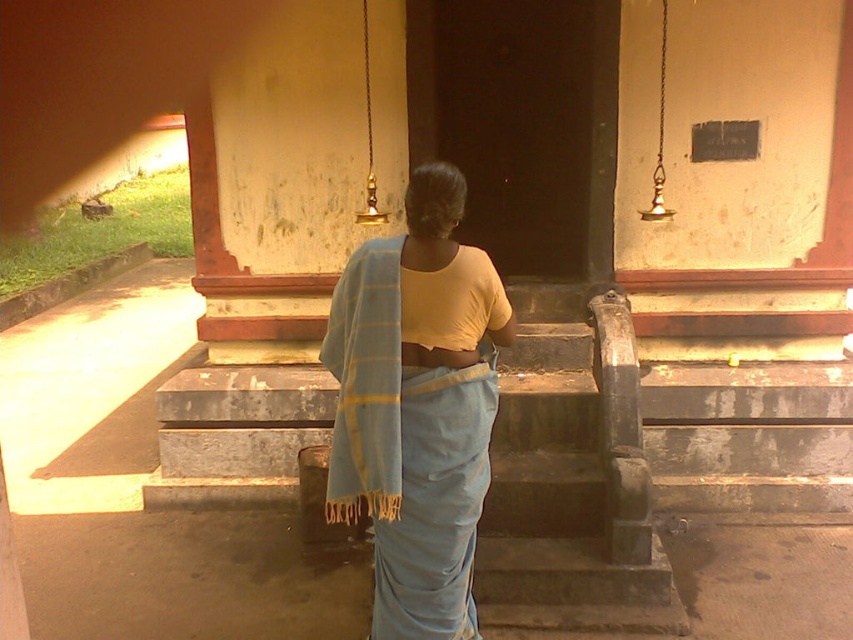
Question: Which of the following is the closest to the observer?

Choices:
 (A) light blue woven shawl at center
 (B) light blue fabric at center

Answer: (B)

Question: Is light blue fabric at center above light blue woven shawl at center?

Choices:
 (A) yes
 (B) no

Answer: (B)

Question: Can you confirm if light blue fabric at center is positioned to the left of light blue woven shawl at center?

Choices:
 (A) no
 (B) yes

Answer: (A)

Question: Which object appears farthest from the camera in this image?

Choices:
 (A) light blue fabric at center
 (B) light blue woven shawl at center

Answer: (B)

Question: Which of the following is the farthest from the observer?

Choices:
 (A) (408, 508)
 (B) (370, 353)

Answer: (A)

Question: Can you confirm if light blue fabric at center is wider than light blue woven shawl at center?

Choices:
 (A) yes
 (B) no

Answer: (A)